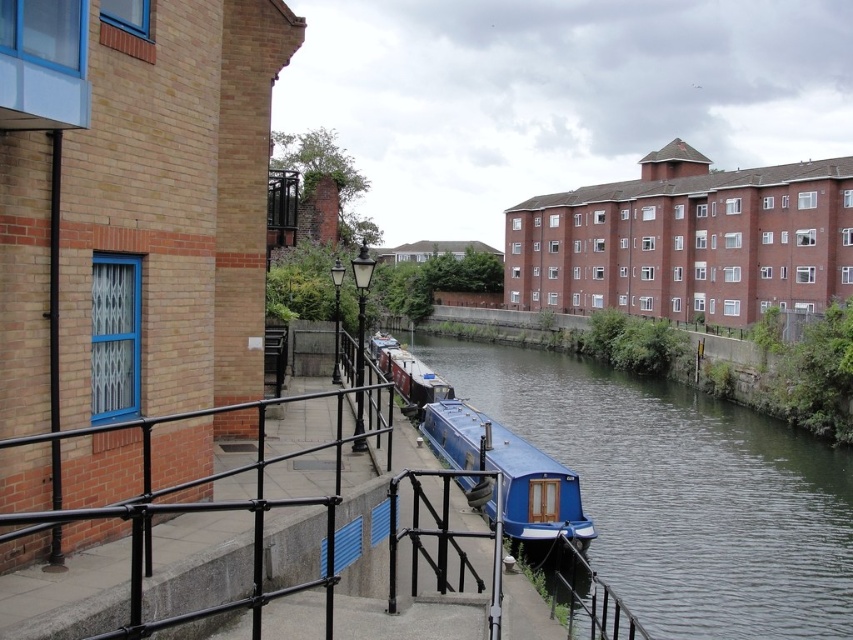
You are a delivery person needing to load a 2.5 meter wide crate onto a boat. The blue glossy boat at center and the matte blue boat at center are both available. Which boat can accommodate the crate based on their widths?

The blue glossy boat at center is wider than the matte blue boat at center, so the crate can fit on the blue glossy boat at center but not on the matte blue boat at center.

You are standing on the walkway near the brick building and want to take a photo of both point (730,563) and point (550,518) in the scene. Which point will appear closer to the camera in your photo?

Point (730,563) is further to the viewer than point (550,518), so in the photo, point (550,518) will appear closer to the camera.